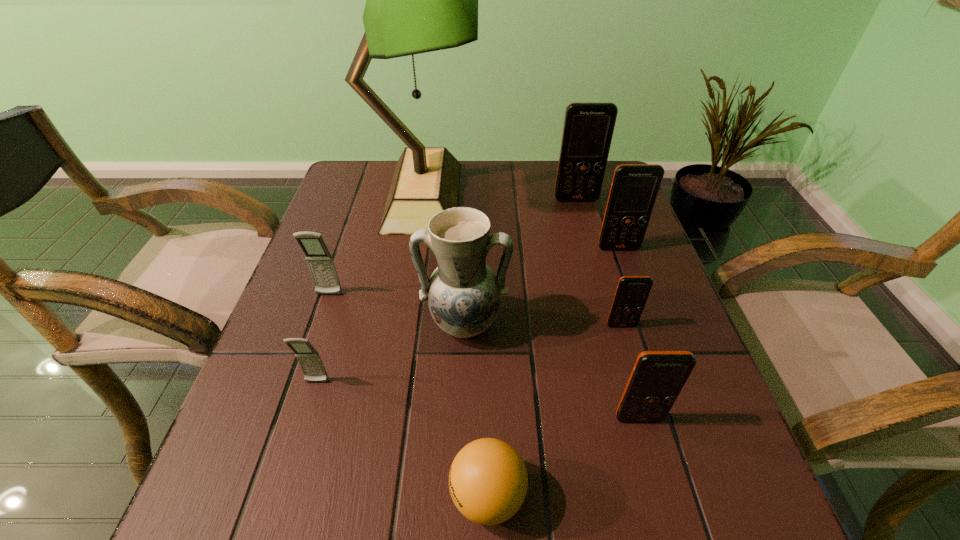
This screenshot has height=540, width=960. I want to click on free space located on the screen of the third farthest object, so click(x=668, y=392).

At what (x,y) coordinates should I click in order to perform the action: click on free space located on the front-facing side of the sixth nearest object. Please return your answer as a coordinate pair (x, y). Looking at the image, I should click on (279, 443).

Identify the location of free location located on the screen of the second smallest orange cellular telephone. The height and width of the screenshot is (540, 960). (649, 454).

Locate an element on the screen. free space located on the screen of the third nearest cellular telephone is located at coordinates (670, 489).

Identify the location of free space located 0.170m on the front-facing side of the seventh farthest object. Image resolution: width=960 pixels, height=540 pixels. (286, 484).

The width and height of the screenshot is (960, 540). I want to click on vacant space situated 0.290m on the side with brand of the ping-pong ball, so click(255, 495).

Find the location of a particular element. free space located on the side with brand of the ping-pong ball is located at coordinates [x=410, y=495].

The image size is (960, 540). I want to click on free spot located 0.120m on the side with brand of the ping-pong ball, so click(x=370, y=495).

At what (x,y) coordinates should I click in order to perform the action: click on table lamp located at the far edge. Please return your answer as a coordinate pair (x, y). Image resolution: width=960 pixels, height=540 pixels. Looking at the image, I should click on (418, 0).

Identify the location of cellular telephone at the far edge. Image resolution: width=960 pixels, height=540 pixels. [x=588, y=128].